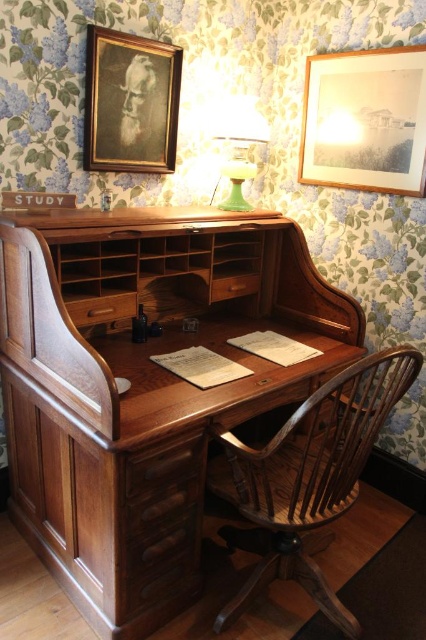
Question: Can you confirm if polished wood writing desk at center is positioned below wooden drawer at center?

Choices:
 (A) yes
 (B) no

Answer: (A)

Question: Estimate the real-world distances between objects in this image. Which object is closer to the matte wooden picture frame at upper right?

Choices:
 (A) wooden drawer at center
 (B) wooden chair at center

Answer: (A)

Question: Observing the image, what is the correct spatial positioning of polished wood writing desk at center in reference to green glass lamp at upper center?

Choices:
 (A) left
 (B) right

Answer: (A)

Question: Which point is farther to the camera?

Choices:
 (A) wooden chair at center
 (B) polished wood writing desk at center

Answer: (B)

Question: Which point appears farthest from the camera in this image?

Choices:
 (A) (172, 262)
 (B) (198, 464)
 (C) (403, 68)

Answer: (A)

Question: Can you confirm if matte wooden picture frame at upper right is positioned to the right of mahogany drawer at center?

Choices:
 (A) yes
 (B) no

Answer: (A)